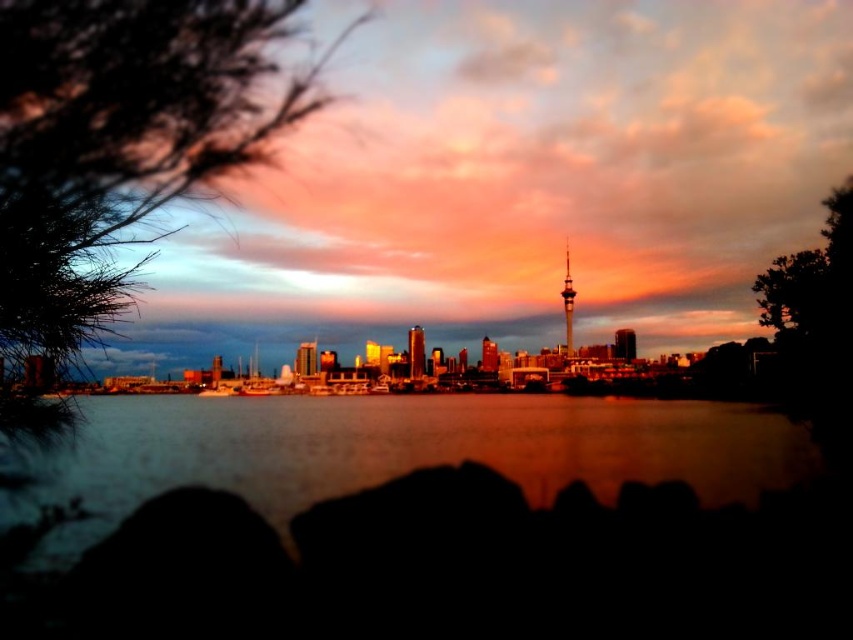
Can you confirm if silvery reflective water at center is smaller than dark green leafy tree at right?

No.

Does point (566, 428) lie in front of point (798, 333)?

Yes, it is in front of point (798, 333).

Where is `silvery reflective water at center`? This screenshot has width=853, height=640. silvery reflective water at center is located at coordinates (393, 451).

Is dark green leafy tree at right behind shiny metallic tv tower at center?

No, it is not.

Is point (820, 356) in front of point (570, 352)?

Yes, it is in front of point (570, 352).

Find the location of a particular element. This screenshot has height=640, width=853. dark green leafy tree at right is located at coordinates (815, 324).

From the picture: Does green leafy tree at left appear on the left side of silvery reflective water at center?

Yes, green leafy tree at left is to the left of silvery reflective water at center.

Which is behind, point (282, 38) or point (222, 458)?

Positioned behind is point (282, 38).

Is point (128, 224) in front of point (265, 484)?

No, (128, 224) is further to viewer.

Identify the location of green leafy tree at left. This screenshot has width=853, height=640. (119, 141).